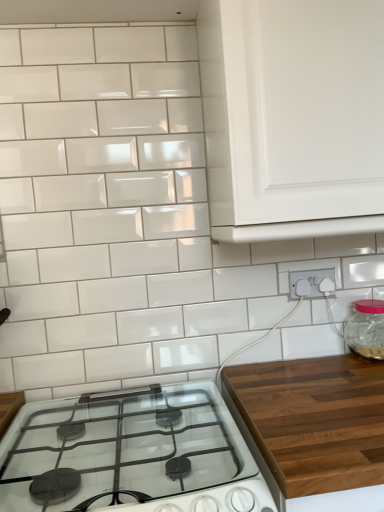
Question: Is transparent glass jar at right facing towards white glossy cabinet at upper right?

Choices:
 (A) yes
 (B) no

Answer: (B)

Question: From the image's perspective, is transparent glass jar at right located above white glossy cabinet at upper right?

Choices:
 (A) no
 (B) yes

Answer: (A)

Question: From a real-world perspective, is transparent glass jar at right under white glossy cabinet at upper right?

Choices:
 (A) no
 (B) yes

Answer: (B)

Question: From the image's perspective, is transparent glass jar at right beneath white glossy cabinet at upper right?

Choices:
 (A) no
 (B) yes

Answer: (B)

Question: Is transparent glass jar at right shorter than white glossy cabinet at upper right?

Choices:
 (A) yes
 (B) no

Answer: (A)

Question: Considering the relative sizes of transparent glass jar at right and white glossy cabinet at upper right in the image provided, is transparent glass jar at right taller than white glossy cabinet at upper right?

Choices:
 (A) no
 (B) yes

Answer: (A)

Question: From a real-world perspective, is white glossy cabinet at upper right beneath white glossy gas stove at lower center?

Choices:
 (A) no
 (B) yes

Answer: (A)

Question: Is white glossy cabinet at upper right positioned in front of white glossy gas stove at lower center?

Choices:
 (A) no
 (B) yes

Answer: (A)

Question: Is white glossy cabinet at upper right next to white glossy gas stove at lower center?

Choices:
 (A) yes
 (B) no

Answer: (B)

Question: Is white glossy cabinet at upper right taller than white glossy gas stove at lower center?

Choices:
 (A) no
 (B) yes

Answer: (B)

Question: Is white glossy cabinet at upper right positioned far away from white glossy gas stove at lower center?

Choices:
 (A) no
 (B) yes

Answer: (A)

Question: Is white glossy cabinet at upper right smaller than white glossy gas stove at lower center?

Choices:
 (A) yes
 (B) no

Answer: (B)

Question: From the image's perspective, is white plastic electrical outlet at lower right beneath transparent glass jar at right?

Choices:
 (A) no
 (B) yes

Answer: (A)